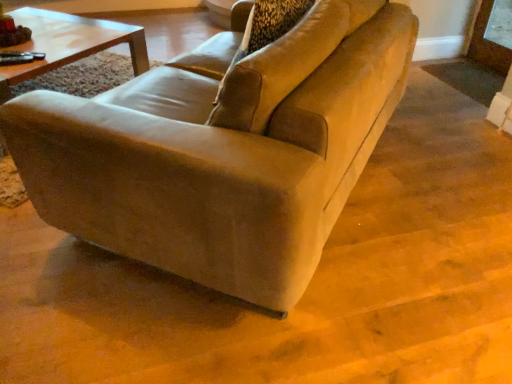
What is the approximate height of suede-like beige couch at center?

suede-like beige couch at center is 28.48 inches tall.

I want to click on suede-like beige couch at center, so click(223, 152).

This screenshot has width=512, height=384. What do you see at coordinates (223, 152) in the screenshot?
I see `suede-like beige couch at center` at bounding box center [223, 152].

Where is `suede-like beige couch at center`? The image size is (512, 384). suede-like beige couch at center is located at coordinates (223, 152).